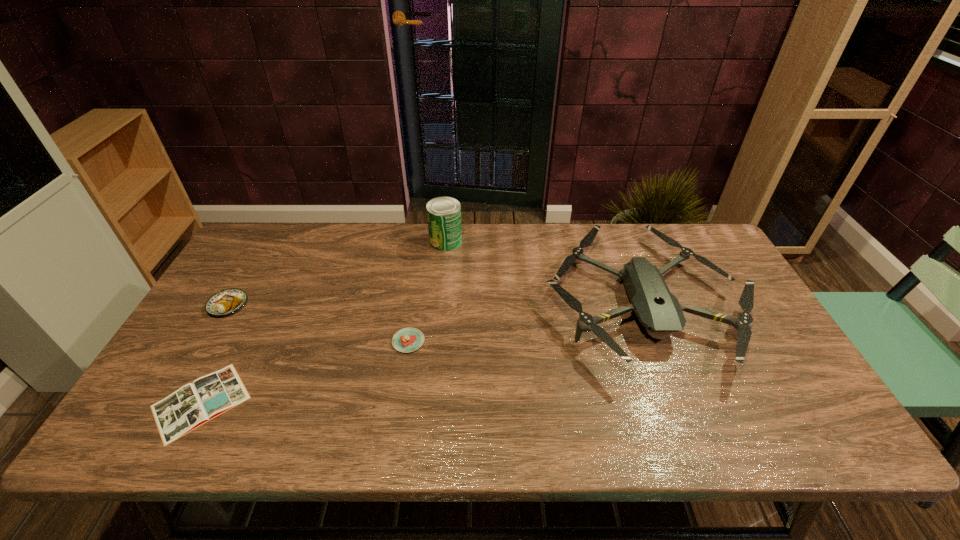
Find the location of `free spot that satisfies the following two spatial constraints: 1. on the back side of the right pastry; 2. on the right side of the book`. free spot that satisfies the following two spatial constraints: 1. on the back side of the right pastry; 2. on the right side of the book is located at coordinates (233, 341).

Image resolution: width=960 pixels, height=540 pixels. Identify the location of free region that satisfies the following two spatial constraints: 1. on the front side of the nearer pastry; 2. on the right side of the farther pastry. (206, 341).

Image resolution: width=960 pixels, height=540 pixels. In order to click on free location that satisfies the following two spatial constraints: 1. on the back side of the third tallest object; 2. on the right side of the tallest object in this screenshot , I will do `click(266, 241)`.